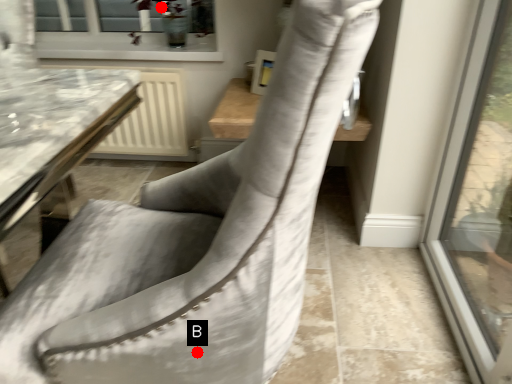
Question: Two points are circled on the image, labeled by A and B beside each circle. Among these points, which one is farthest from the camera?

Choices:
 (A) A is further
 (B) B is further

Answer: (A)